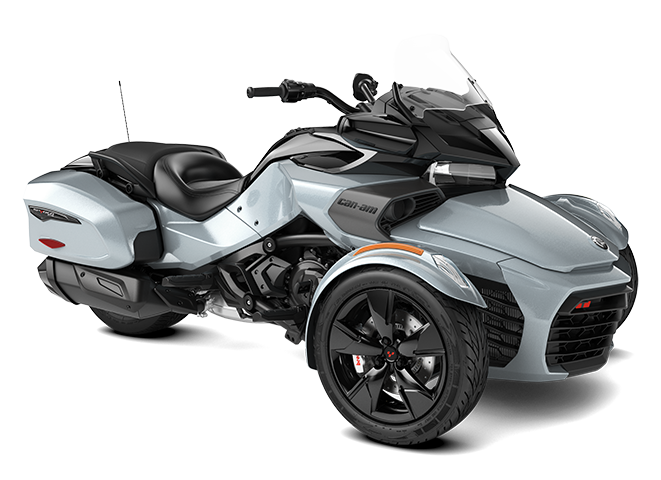
Where is `seat`? seat is located at coordinates (134, 153).